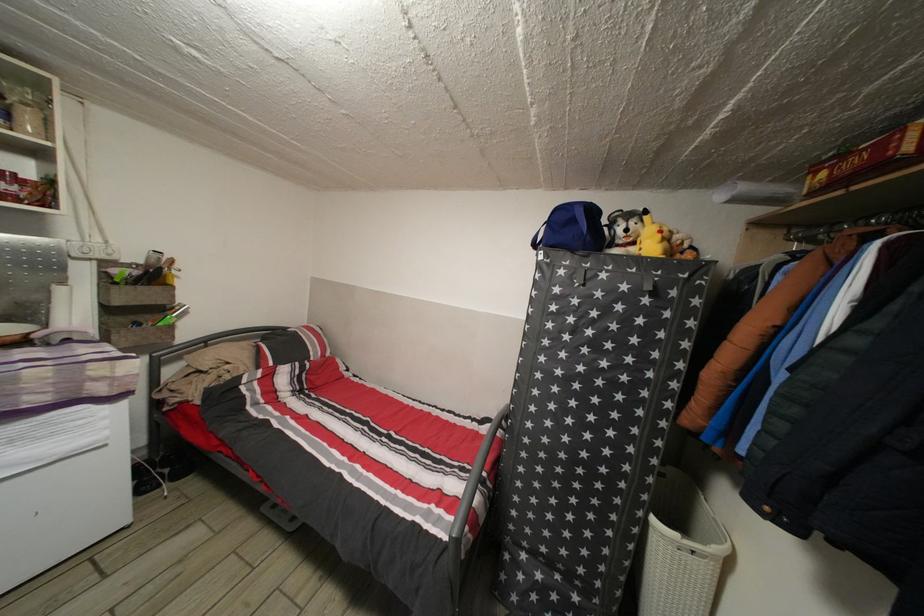
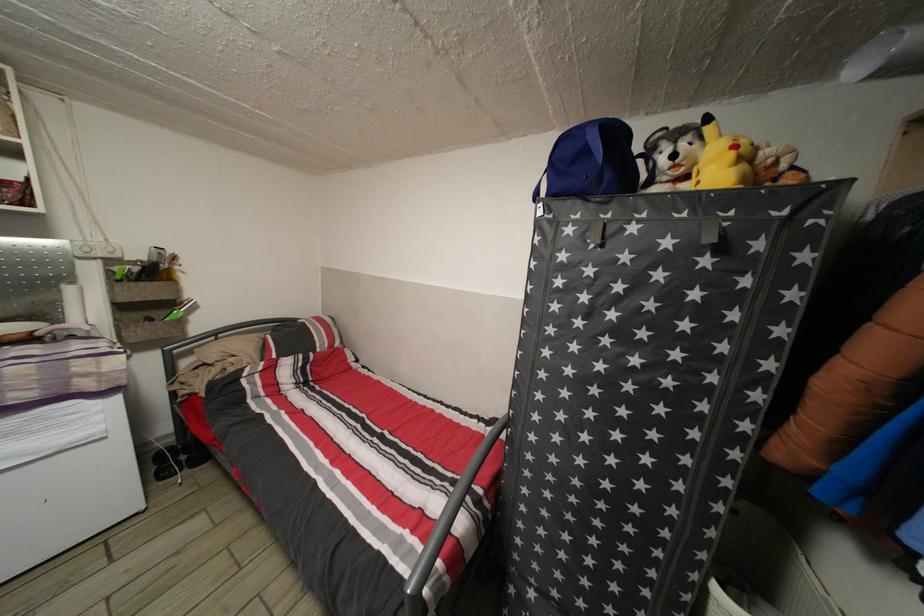
In the second image, find the point that corresponds to (x=117, y=317) in the first image.

(128, 314)